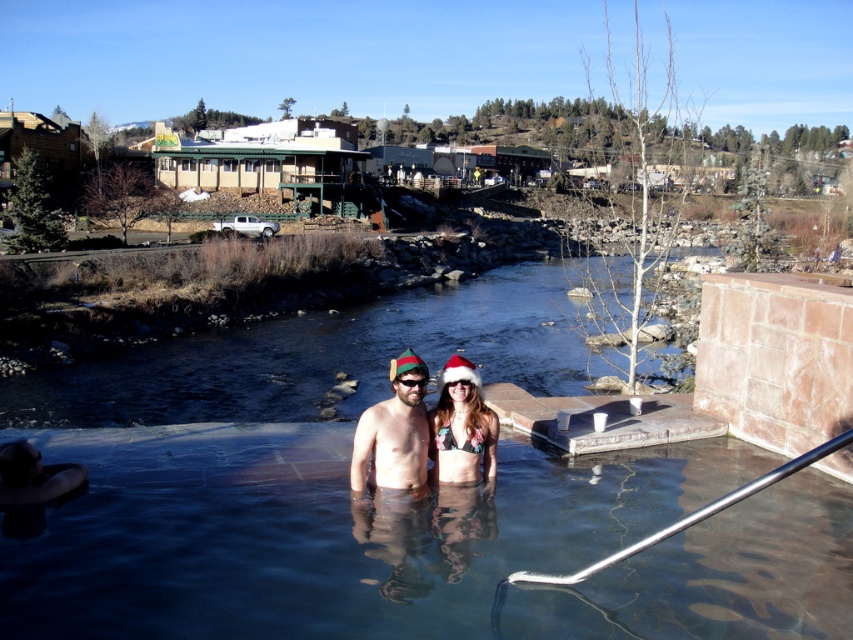
Question: Does clear glass pool at center have a greater width compared to matte red bikini at center?

Choices:
 (A) yes
 (B) no

Answer: (B)

Question: Among these points, which one is nearest to the camera?

Choices:
 (A) (412, 368)
 (B) (409, 381)
 (C) (706, 564)
 (D) (485, 413)

Answer: (C)

Question: Which of the following is the farthest from the observer?

Choices:
 (A) matte black goggles at center
 (B) clear water at center

Answer: (B)

Question: Can you confirm if matte red bikini at center is positioned above matte black goggles at center?

Choices:
 (A) yes
 (B) no

Answer: (B)

Question: Which point is closer to the camera?

Choices:
 (A) (477, 532)
 (B) (384, 426)

Answer: (A)

Question: Can you confirm if clear glass pool at center is bigger than matte red bikini at center?

Choices:
 (A) yes
 (B) no

Answer: (B)